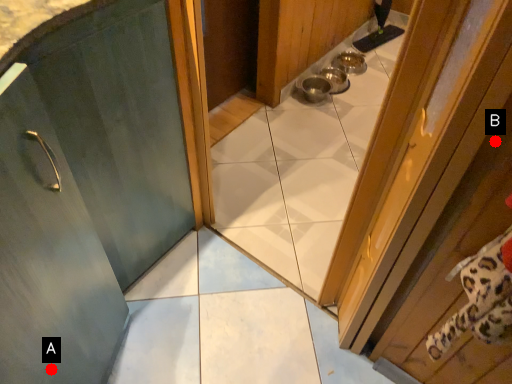
Question: Two points are circled on the image, labeled by A and B beside each circle. Which point is farther from the camera taking this photo?

Choices:
 (A) A is further
 (B) B is further

Answer: (A)